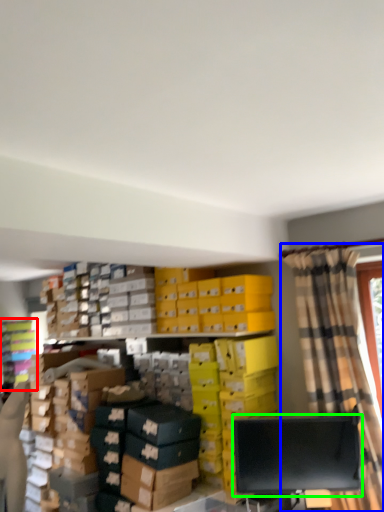
Question: Considering the real-world distances, which object is closest to shelf (highlighted by a red box)? curtain (highlighted by a blue box) or computer monitor (highlighted by a green box).

Choices:
 (A) curtain
 (B) computer monitor

Answer: (B)